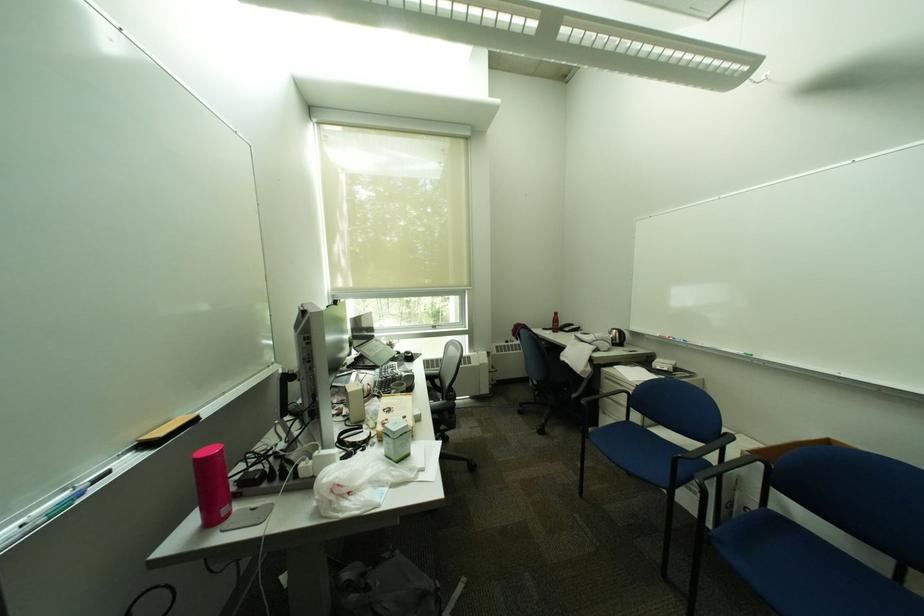
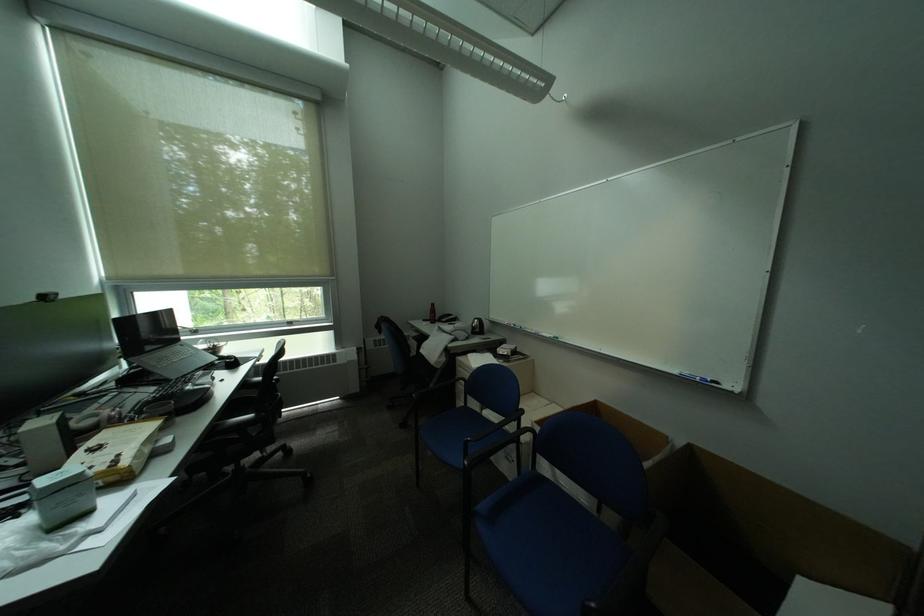
Question: The images are taken continuously from a first-person perspective. In which direction is your viewpoint rotating?

Choices:
 (A) Left
 (B) Right
 (C) Up
 (D) Down

Answer: (B)